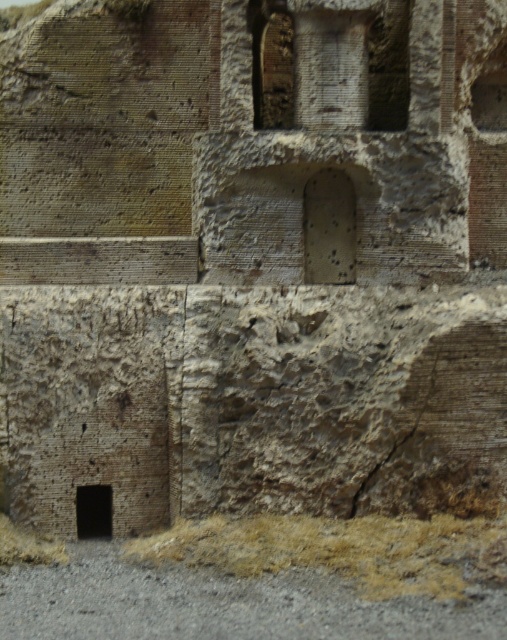
Who is higher up, brown dry grass at lower center or black stone hole at lower left?

Positioned higher is black stone hole at lower left.

Does brown dry grass at lower center have a greater height compared to black stone hole at lower left?

No.

Is point (340, 522) in front of point (80, 522)?

Yes, point (340, 522) is closer to viewer.

Find the location of a particular element. brown dry grass at lower center is located at coordinates (341, 548).